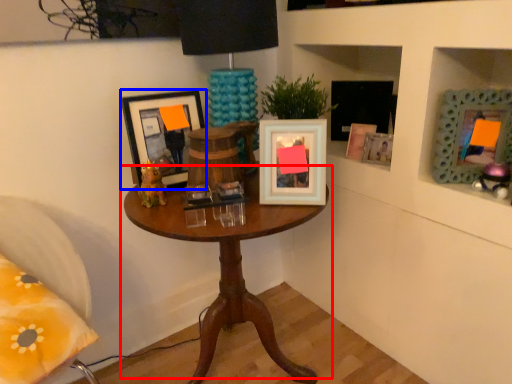
Question: Which object appears farthest to the camera in this image, table (highlighted by a red box) or picture frame (highlighted by a blue box)?

Choices:
 (A) table
 (B) picture frame

Answer: (B)